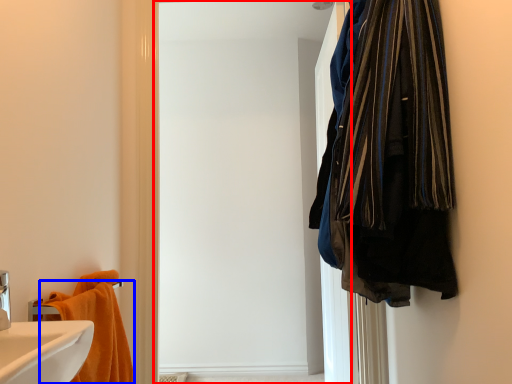
Question: Which point is further to the camera, screen door (highlighted by a red box) or towel (highlighted by a blue box)?

Choices:
 (A) screen door
 (B) towel

Answer: (A)